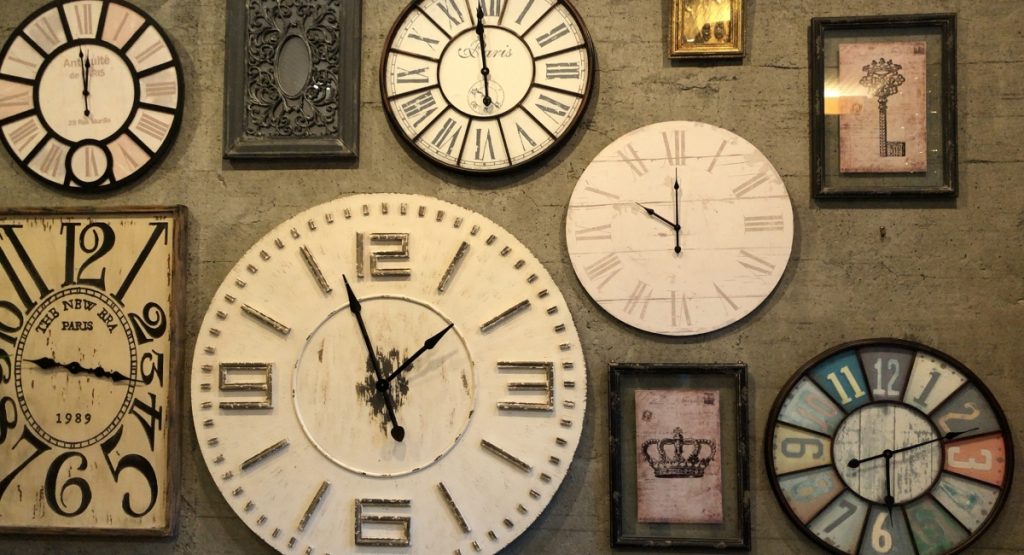
Locate an element on the screen. clocks is located at coordinates (109, 113), (504, 98), (673, 211), (514, 289), (111, 312), (952, 455).